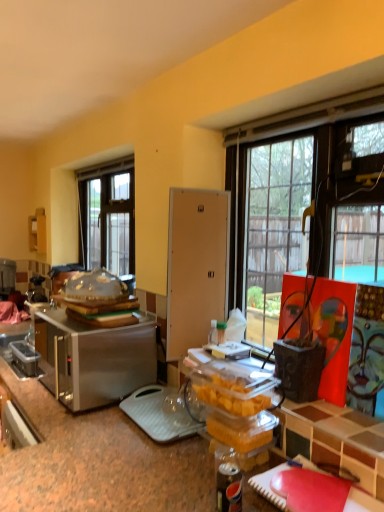
In the scene shown: What is the approximate height of clear plastic dome at center?

clear plastic dome at center is 5.60 inches in height.

This screenshot has height=512, width=384. What do you see at coordinates (97, 358) in the screenshot?
I see `satin silver toaster at left, marked as the first appliance in a front-to-back arrangement` at bounding box center [97, 358].

This screenshot has width=384, height=512. What do you see at coordinates (7, 278) in the screenshot? I see `brushed metal toaster at left, the 2th appliance positioned from the front` at bounding box center [7, 278].

The height and width of the screenshot is (512, 384). I want to click on matte white cabinet at left, so click(x=37, y=231).

Is clear glass window at upper left next to satin silver toaster at left, the second appliance in the back-to-front sequence?

No, clear glass window at upper left is not beside satin silver toaster at left, the second appliance in the back-to-front sequence.

From the image's perspective, is clear glass window at upper left located beneath satin silver toaster at left, the second appliance in the left-to-right sequence?

No, from the image's perspective, clear glass window at upper left is not below satin silver toaster at left, the second appliance in the left-to-right sequence.

Measure the distance between clear glass window at upper left and satin silver toaster at left, the second appliance in the left-to-right sequence.

They are 4.00 feet apart.

From a real-world perspective, which is physically above, clear glass window at upper left or satin silver toaster at left, which is counted as the 1th appliance, starting from the right?

From a 3D spatial view, clear glass window at upper left is above.

From a real-world perspective, is clear glass window at upper left positioned above or below brushed metal toaster at left, which appears as the second appliance when viewed from the right?

In terms of real-world spatial position, clear glass window at upper left is above brushed metal toaster at left, which appears as the second appliance when viewed from the right.

Would you say clear glass window at upper left is inside or outside brushed metal toaster at left, the 2th appliance positioned from the front?

clear glass window at upper left is not inside brushed metal toaster at left, the 2th appliance positioned from the front, it's outside.

Is clear glass window at upper left next to brushed metal toaster at left, the 2th appliance positioned from the front, and touching it?

There is a gap between clear glass window at upper left and brushed metal toaster at left, the 2th appliance positioned from the front.

Who is shorter, clear glass window at upper left or brushed metal toaster at left, which is the 1th appliance from back to front?

brushed metal toaster at left, which is the 1th appliance from back to front.

Considering the relative sizes of clear glass window at upper left and clear plastic dome at center in the image provided, is clear glass window at upper left smaller than clear plastic dome at center?

Incorrect, clear glass window at upper left is not smaller in size than clear plastic dome at center.

Which object is positioned more to the left, clear glass window at upper left or clear plastic dome at center?

From the viewer's perspective, clear glass window at upper left appears more on the left side.

Between clear glass window at upper left and clear plastic dome at center, which one has smaller width?

Thinner between the two is clear glass window at upper left.

Looking at this image, would you say clear glass window at upper left contains clear plastic dome at center?

Actually, clear plastic dome at center is outside clear glass window at upper left.

From the image's perspective, is clear plastic dome at center positioned above or below brushed metal toaster at left, which is the 1th appliance from back to front?

Clearly, from the image's perspective, clear plastic dome at center is above brushed metal toaster at left, which is the 1th appliance from back to front.

Which point is more forward, (86,297) or (0,276)?

The point (86,297) is closer.

Is clear plastic dome at center at the right side of brushed metal toaster at left, the 2th appliance positioned from the front?

Indeed, clear plastic dome at center is positioned on the right side of brushed metal toaster at left, the 2th appliance positioned from the front.

Considering the relative sizes of clear plastic dome at center and satin silver toaster at left, marked as the first appliance in a front-to-back arrangement, in the image provided, is clear plastic dome at center shorter than satin silver toaster at left, marked as the first appliance in a front-to-back arrangement,?

Yes, clear plastic dome at center is shorter than satin silver toaster at left, marked as the first appliance in a front-to-back arrangement.

Looking at this image, is satin silver toaster at left, marked as the first appliance in a front-to-back arrangement, at the back of clear plastic dome at center?

clear plastic dome at center does not have its back to satin silver toaster at left, marked as the first appliance in a front-to-back arrangement.

Is clear plastic dome at center surrounding satin silver toaster at left, the second appliance in the left-to-right sequence?

No, satin silver toaster at left, the second appliance in the left-to-right sequence, is not a part of clear plastic dome at center.

From the image's perspective, does clear plastic dome at center appear lower than satin silver toaster at left, the second appliance in the left-to-right sequence?

No.

Considering the relative sizes of satin silver toaster at left, the second appliance in the back-to-front sequence, and clear plastic dome at center in the image provided, is satin silver toaster at left, the second appliance in the back-to-front sequence, bigger than clear plastic dome at center?

Correct, satin silver toaster at left, the second appliance in the back-to-front sequence, is larger in size than clear plastic dome at center.

Considering the relative positions of satin silver toaster at left, the second appliance in the back-to-front sequence, and clear plastic dome at center in the image provided, is satin silver toaster at left, the second appliance in the back-to-front sequence, to the left of clear plastic dome at center from the viewer's perspective?

Incorrect, satin silver toaster at left, the second appliance in the back-to-front sequence, is not on the left side of clear plastic dome at center.

Which is closer to the camera, (104,362) or (111,291)?

Point (104,362) is closer to the camera than point (111,291).

Who is more distant, satin silver toaster at left, marked as the first appliance in a front-to-back arrangement, or clear plastic dome at center?

clear plastic dome at center is further away from the camera.

Considering the relative sizes of clear plastic dome at center and clear glass window at upper left in the image provided, is clear plastic dome at center bigger than clear glass window at upper left?

No, clear plastic dome at center is not bigger than clear glass window at upper left.

Does clear plastic dome at center have a greater width compared to clear glass window at upper left?

Yes.

Is clear plastic dome at center to the left of clear glass window at upper left from the viewer's perspective?

Incorrect, clear plastic dome at center is not on the left side of clear glass window at upper left.

Do you think clear plastic dome at center is within clear glass window at upper left, or outside of it?

clear plastic dome at center is not enclosed by clear glass window at upper left.

This screenshot has height=512, width=384. I want to click on window that is above the satin silver toaster at left, the second appliance in the back-to-front sequence (from the image's perspective), so click(x=107, y=216).

Identify the location of the 1st appliance directly beneath the clear glass window at upper left (from a real-world perspective). (7, 278).

When comparing their distances from clear plastic dome at center, does brushed metal toaster at left, which appears as the second appliance when viewed from the right, or matte white cabinet at left seem further?

Based on the image, brushed metal toaster at left, which appears as the second appliance when viewed from the right, appears to be further to clear plastic dome at center.

When comparing their distances from clear glass window at upper left, does brushed metal toaster at left, which appears as the second appliance when viewed from the right, or matte white cabinet at left seem closer?

Among the two, matte white cabinet at left is located nearer to clear glass window at upper left.

Consider the image. From the image, which object appears to be farther from clear plastic dome at center, matte white cabinet at left or brushed metal toaster at left, the first appliance viewed from the left?

Among the two, brushed metal toaster at left, the first appliance viewed from the left, is located further to clear plastic dome at center.

Looking at the image, which one is located further to clear glass window at upper left, clear plastic dome at center or satin silver toaster at left, the second appliance in the back-to-front sequence?

satin silver toaster at left, the second appliance in the back-to-front sequence, is further to clear glass window at upper left.

From the image, which object appears to be farther from matte white cabinet at left, brushed metal toaster at left, the 2th appliance positioned from the front, or clear plastic dome at center?

Based on the image, clear plastic dome at center appears to be further to matte white cabinet at left.

From the image, which object appears to be nearer to brushed metal toaster at left, the 2th appliance positioned from the front, clear glass window at upper left or satin silver toaster at left, the second appliance in the back-to-front sequence?

clear glass window at upper left is closer to brushed metal toaster at left, the 2th appliance positioned from the front.

Estimate the real-world distances between objects in this image. Which object is further from brushed metal toaster at left, the first appliance viewed from the left, clear plastic dome at center or satin silver toaster at left, which is counted as the 1th appliance, starting from the right?

satin silver toaster at left, which is counted as the 1th appliance, starting from the right, lies further to brushed metal toaster at left, the first appliance viewed from the left, than the other object.

When comparing their distances from clear glass window at upper left, does brushed metal toaster at left, which appears as the second appliance when viewed from the right, or clear plastic dome at center seem further?

clear plastic dome at center is positioned further to the anchor clear glass window at upper left.

Locate an element on the screen. This screenshot has height=512, width=384. appliance located between satin silver toaster at left, the second appliance in the back-to-front sequence, and matte white cabinet at left in the depth direction is located at coordinates (7, 278).

This screenshot has height=512, width=384. In order to click on window located between satin silver toaster at left, marked as the first appliance in a front-to-back arrangement, and matte white cabinet at left in the depth direction in this screenshot , I will do `click(107, 216)`.

The width and height of the screenshot is (384, 512). In order to click on appliance between clear plastic dome at center and matte white cabinet at left along the z-axis in this screenshot , I will do `click(7, 278)`.

I want to click on window positioned between clear plastic dome at center and matte white cabinet at left from near to far, so click(107, 216).